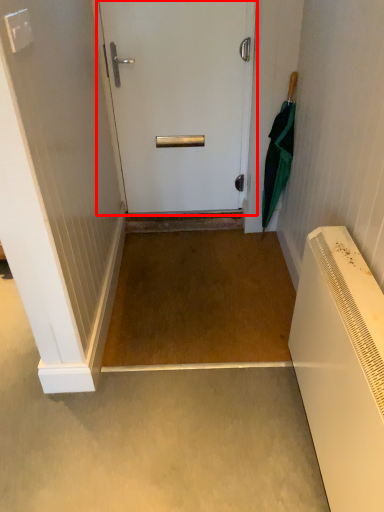
Question: Considering the relative positions of door (annotated by the red box) and umbrella in the image provided, where is door (annotated by the red box) located with respect to the staircase?

Choices:
 (A) right
 (B) left

Answer: (B)